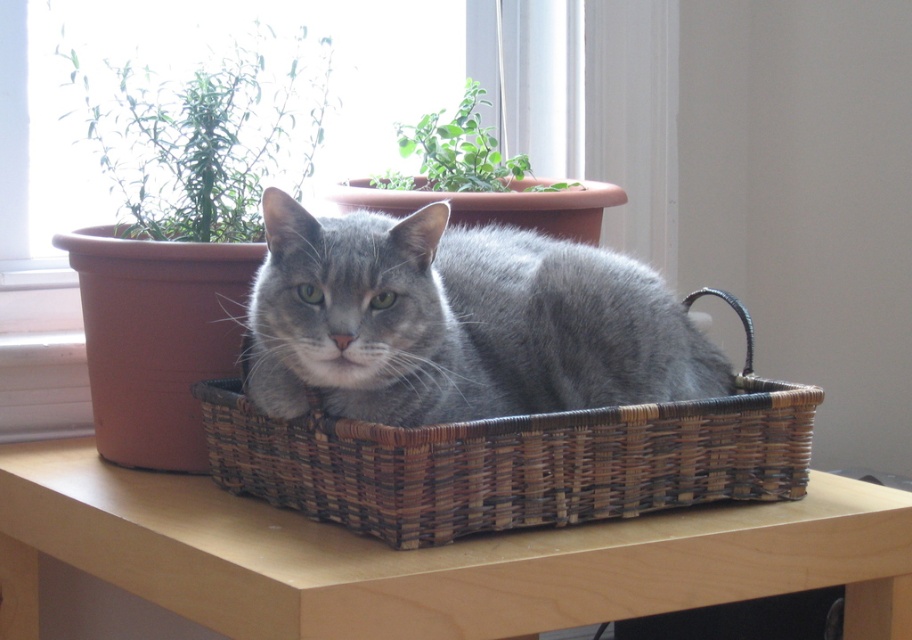
Question: Is the position of gray matte fur cat at center more distant than that of woven brown basket at center?

Choices:
 (A) yes
 (B) no

Answer: (B)

Question: Which object appears closest to the camera in this image?

Choices:
 (A) wooden table at center
 (B) green leafy plant at upper center

Answer: (A)

Question: Is wooden table at center closer to camera compared to woven brown basket at center?

Choices:
 (A) yes
 (B) no

Answer: (A)

Question: Which of these objects is positioned farthest from the wooden table at center?

Choices:
 (A) green leafy plant at upper left
 (B) woven brown basket at center
 (C) gray matte fur cat at center

Answer: (A)

Question: Which object is positioned farthest from the woven brown basket at center?

Choices:
 (A) green leafy plant at upper left
 (B) wooden table at center
 (C) green leafy plant at upper center
 (D) gray matte fur cat at center

Answer: (C)

Question: Can you confirm if green leafy plant at upper left is positioned below green leafy plant at upper center?

Choices:
 (A) no
 (B) yes

Answer: (A)